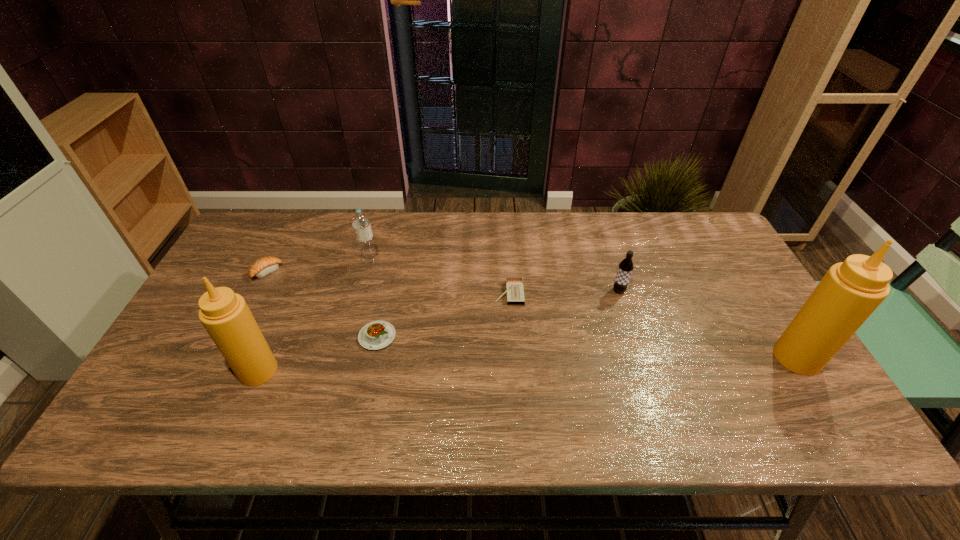
At what (x,y) coordinates should I click in order to perform the action: click on the second tallest object. Please return your answer as a coordinate pair (x, y). The height and width of the screenshot is (540, 960). Looking at the image, I should click on (225, 315).

In order to click on the shorter condiment in this screenshot , I will do pyautogui.click(x=225, y=315).

Locate an element on the screen. the taller condiment is located at coordinates (850, 291).

At what (x,y) coordinates should I click in order to perform the action: click on the tallest object. Please return your answer as a coordinate pair (x, y). The width and height of the screenshot is (960, 540). Looking at the image, I should click on (850, 291).

Identify the location of the third tallest object. This screenshot has width=960, height=540. (360, 222).

What are the coordinates of `root beer` in the screenshot? It's located at (626, 266).

Locate an element on the screen. This screenshot has height=540, width=960. the second object from right to left is located at coordinates [626, 266].

Locate an element on the screen. This screenshot has width=960, height=540. the shortest object is located at coordinates (514, 291).

Identify the location of matchbox. (514, 291).

The width and height of the screenshot is (960, 540). In order to click on sushi in this screenshot , I will do `click(263, 266)`.